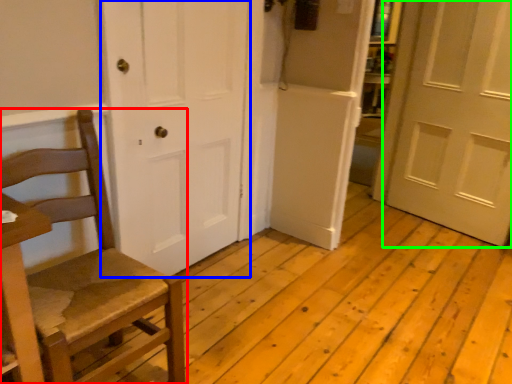
Question: Which object is positioned closest to chair (highlighted by a red box)? Select from door (highlighted by a blue box) and door (highlighted by a green box).

Choices:
 (A) door
 (B) door

Answer: (A)